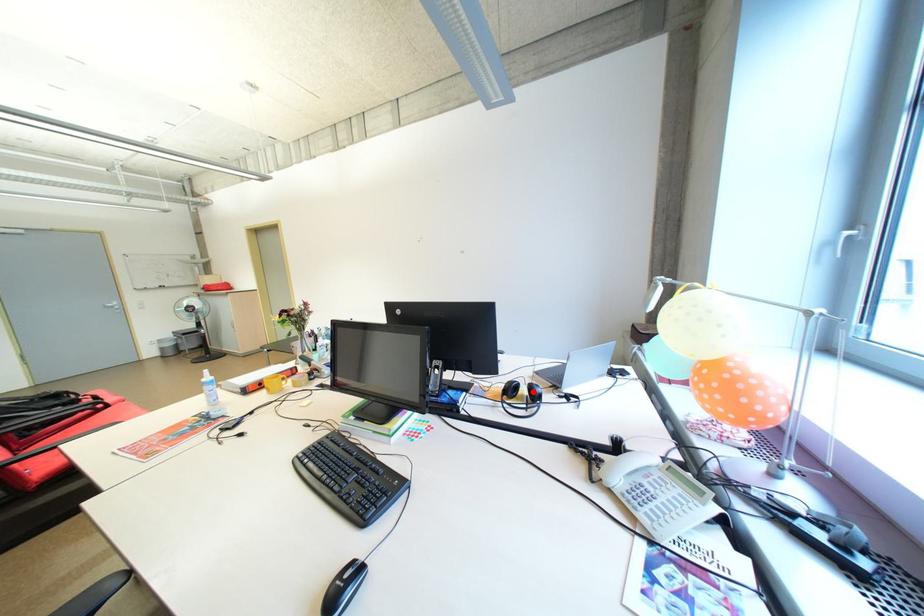
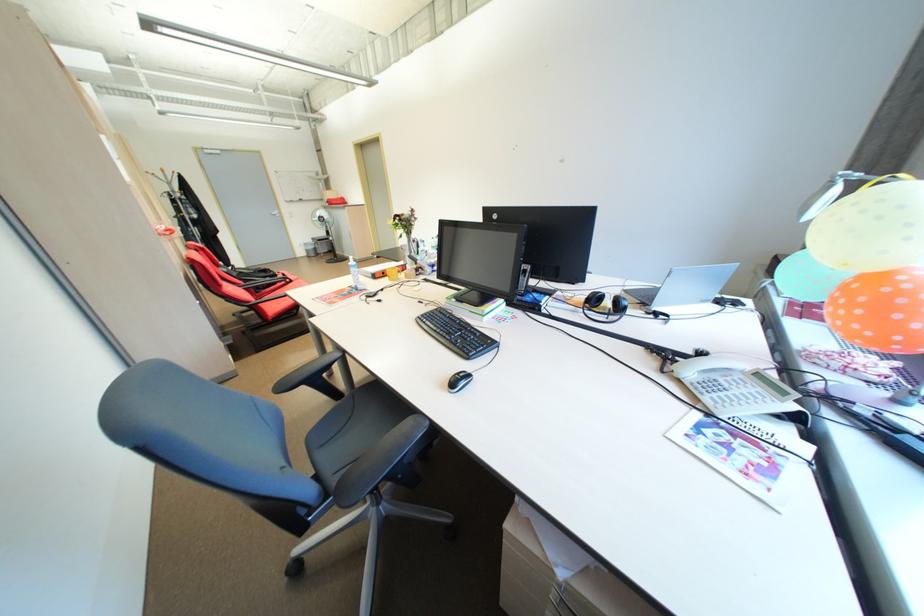
Question: I am providing you with two images of the same scene from different viewpoints. Image1 has a red point marked. In image2, the corresponding 3D location appears at what relative position? Reply with the corresponding letter.

Choices:
 (A) Closer
 (B) Farther

Answer: (A)